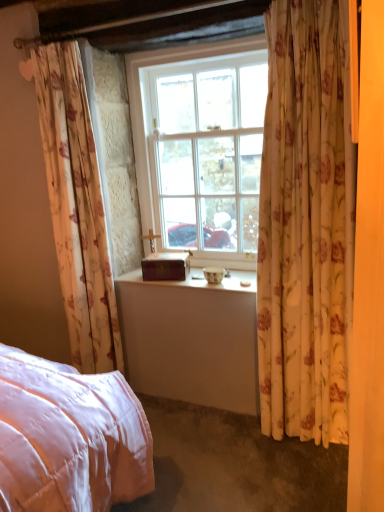
Question: Is floral fabric curtain at left, the 2th curtain from the right, not close to floral fabric curtain at right, the 1th curtain from the right?

Choices:
 (A) no
 (B) yes

Answer: (A)

Question: Does floral fabric curtain at left, marked as the first curtain in a left-to-right arrangement, have a lesser height compared to floral fabric curtain at right, marked as the 2th curtain in a left-to-right arrangement?

Choices:
 (A) no
 (B) yes

Answer: (A)

Question: Can you confirm if floral fabric curtain at left, the 2th curtain from the right, is thinner than floral fabric curtain at right, the 1th curtain from the right?

Choices:
 (A) yes
 (B) no

Answer: (B)

Question: Is the position of floral fabric curtain at left, marked as the first curtain in a left-to-right arrangement, less distant than that of floral fabric curtain at right, marked as the 2th curtain in a left-to-right arrangement?

Choices:
 (A) yes
 (B) no

Answer: (B)

Question: Is floral fabric curtain at left, the 2th curtain from the right, positioned with its back to floral fabric curtain at right, the 1th curtain from the right?

Choices:
 (A) no
 (B) yes

Answer: (A)

Question: From the image's perspective, relative to wooden box at center, is floral fabric curtain at right, marked as the 2th curtain in a left-to-right arrangement, above or below?

Choices:
 (A) below
 (B) above

Answer: (B)

Question: In the image, is floral fabric curtain at right, marked as the 2th curtain in a left-to-right arrangement, positioned in front of or behind wooden box at center?

Choices:
 (A) front
 (B) behind

Answer: (A)

Question: Is floral fabric curtain at right, the 1th curtain from the right, situated inside wooden box at center or outside?

Choices:
 (A) outside
 (B) inside

Answer: (A)

Question: Based on their sizes in the image, would you say floral fabric curtain at right, the 1th curtain from the right, is bigger or smaller than wooden box at center?

Choices:
 (A) small
 (B) big

Answer: (B)

Question: Considering the positions of wooden box at center and floral fabric curtain at left, the 2th curtain from the right, in the image, is wooden box at center wider or thinner than floral fabric curtain at left, the 2th curtain from the right,?

Choices:
 (A) thin
 (B) wide

Answer: (A)

Question: Is wooden box at center spatially inside floral fabric curtain at left, marked as the first curtain in a left-to-right arrangement, or outside of it?

Choices:
 (A) outside
 (B) inside

Answer: (A)

Question: In the image, is wooden box at center positioned in front of or behind floral fabric curtain at left, marked as the first curtain in a left-to-right arrangement?

Choices:
 (A) front
 (B) behind

Answer: (B)

Question: From the image's perspective, is wooden box at center positioned above or below floral fabric curtain at left, marked as the first curtain in a left-to-right arrangement?

Choices:
 (A) below
 (B) above

Answer: (A)

Question: From a real-world perspective, relative to white glass window at center, is wooden box at center vertically above or below?

Choices:
 (A) below
 (B) above

Answer: (A)

Question: Would you say wooden box at center is inside or outside white glass window at center?

Choices:
 (A) inside
 (B) outside

Answer: (B)